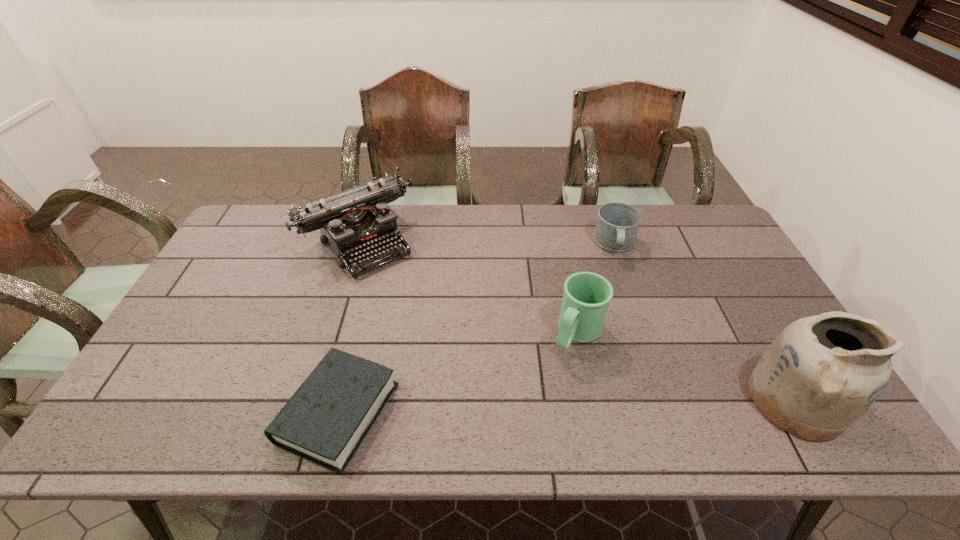
Locate an element on the screen. empty location between the fourth tallest object and the pottery is located at coordinates (705, 322).

This screenshot has height=540, width=960. I want to click on free space that is in between the shortest object and the farther mug, so click(477, 328).

At what (x,y) coordinates should I click in order to perform the action: click on empty space between the typewriter and the nearer mug. Please return your answer as a coordinate pair (x, y). This screenshot has width=960, height=540. Looking at the image, I should click on (x=468, y=287).

Where is `free space between the nearer mug and the pottery`? Image resolution: width=960 pixels, height=540 pixels. free space between the nearer mug and the pottery is located at coordinates (685, 366).

This screenshot has width=960, height=540. I want to click on empty location between the tallest object and the shortest object, so click(566, 406).

Where is `vacant space in between the typewriter and the third nearest object`? This screenshot has width=960, height=540. vacant space in between the typewriter and the third nearest object is located at coordinates (468, 287).

Identify which object is the nearest to the Bible. Please provide its 2D coordinates. Your answer should be formatted as a tuple, i.e. [(x, y)], where the tuple contains the x and y coordinates of a point satisfying the conditions above.

[(354, 222)]

Find the location of `object that stands as the closest to the Bible`. object that stands as the closest to the Bible is located at coordinates (354, 222).

Locate an element on the screen. The image size is (960, 540). free spot that satisfies the following two spatial constraints: 1. on the front side of the rightmost object; 2. on the left side of the typewriter is located at coordinates (308, 400).

The height and width of the screenshot is (540, 960). What are the coordinates of `free spot that satisfies the following two spatial constraints: 1. on the front side of the pottery; 2. on the left side of the third nearest object` in the screenshot? It's located at (590, 400).